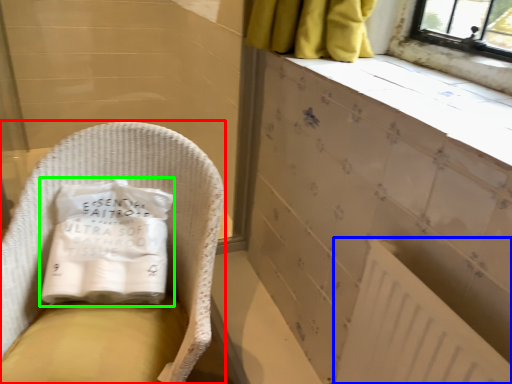
Question: Based on their relative distances, which object is farther from furniture (highlighted by a red box)? Choose from radiator (highlighted by a blue box) and material (highlighted by a green box).

Choices:
 (A) radiator
 (B) material

Answer: (A)